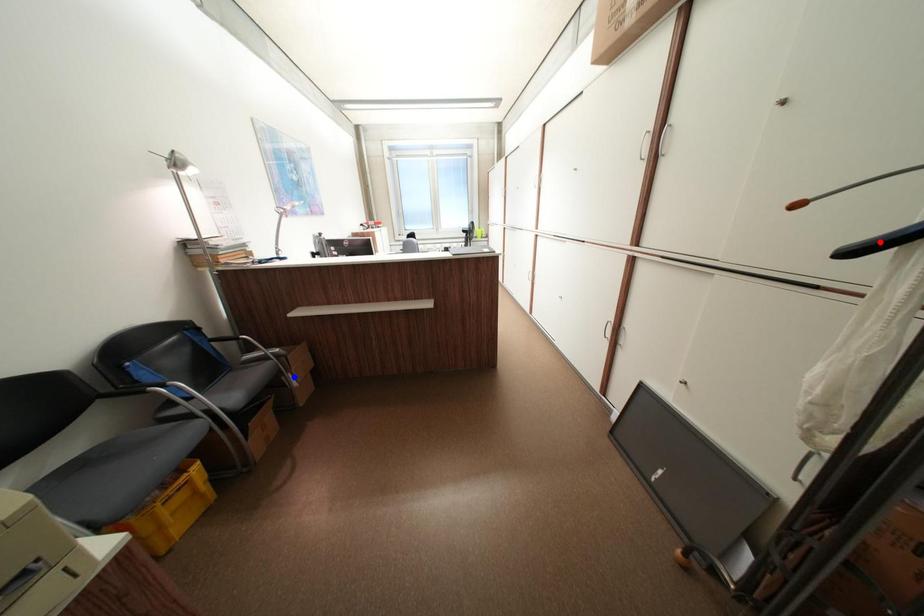
Question: Two points are marked on the image. Which point is closer to the camera?

Choices:
 (A) Blue point is closer.
 (B) Red point is closer.

Answer: (B)